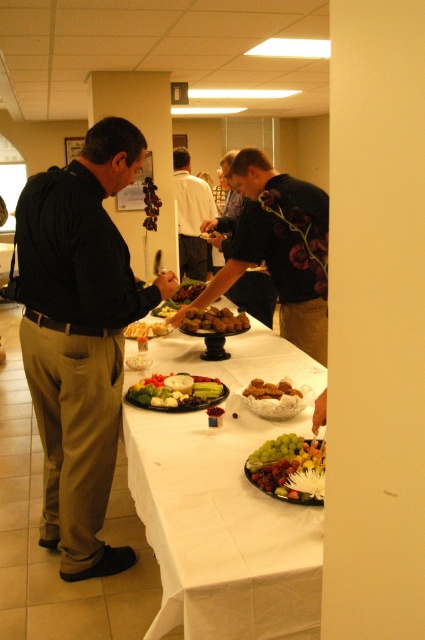
You are planning to serve a guest who prefers larger portions. The brown matte meatballs at center and golden brown bread at center are both on the buffet table. Which of these two items has a larger width and would be better suited for a larger portion?

The brown matte meatballs at center have a larger width than the golden brown bread at center, making them better suited for a larger portion.

You are a food server who needs to place a new dish between the green leafy vegetables at center and the white glossy cheese at center. The dish requires 50 centimeters of space. Is there enough space between them?

The distance between the green leafy vegetables at center and the white glossy cheese at center is 78.08 centimeters, which is more than enough to accommodate the 50 centimeter requirement for the new dish.

You are at the buffet table and want to grab a napkin located at the center. Which direction should you move relative to the white shirt at center?

The white shirt at center is located at point coordinates, so you should move towards the center where the napkin is located. However, since the white shirt is already at the center, you might need to check around it for the napkin.